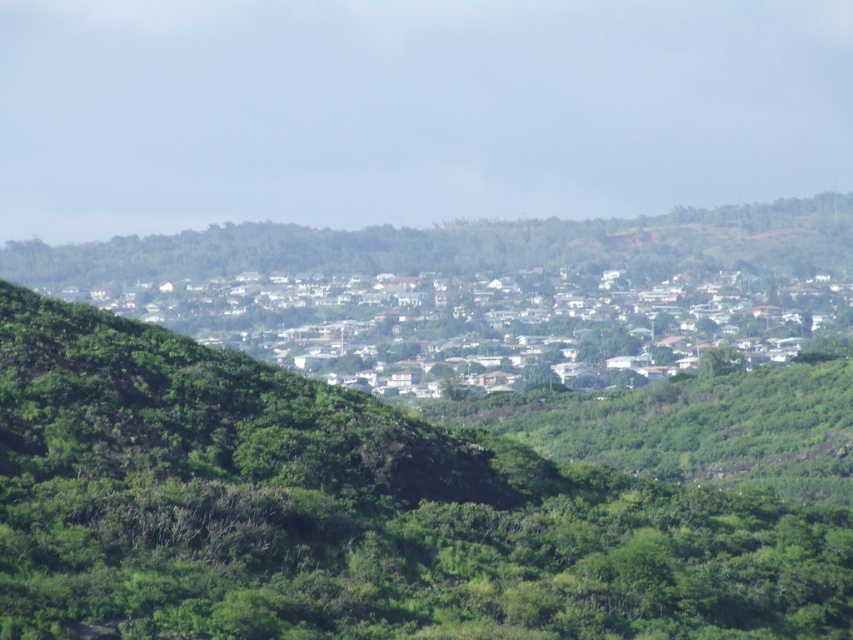
You are a drone operator trying to capture aerial footage of the green leafy tree at center and the white matte houses at center. Based on their positions, which object will appear closer to the camera in the final shot?

The green leafy tree at center will appear closer to the camera in the final shot because it is positioned in front of the white matte houses at center.

What is the main feature located at the coordinates point (349, 513) in the image?

The point (349, 513) marks a green leafy tree at center.